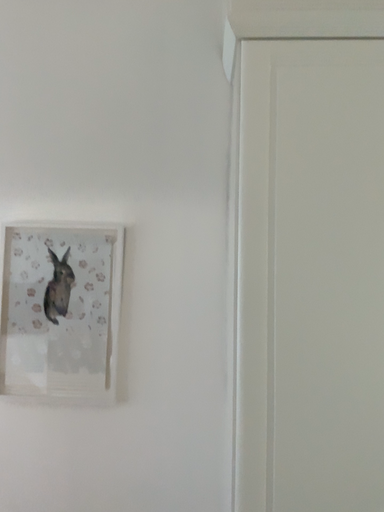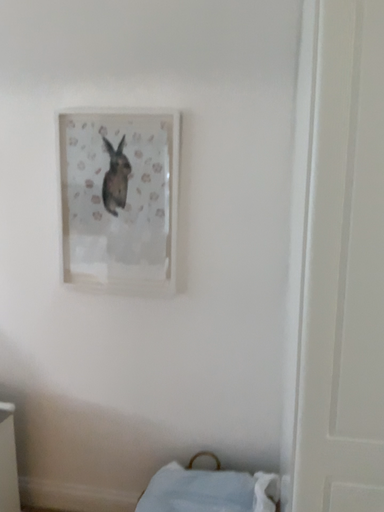
Question: How did the camera likely rotate when shooting the video?

Choices:
 (A) rotated right
 (B) rotated left

Answer: (B)